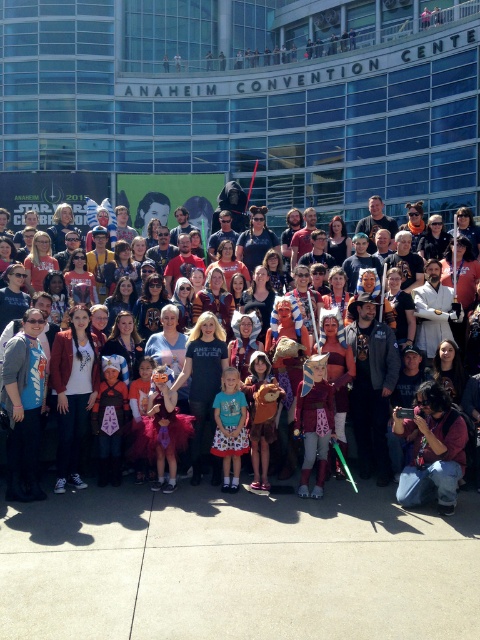
Based on the photo, does matte pink dress at center have a larger size compared to matte blue shirt at center?

Yes.

Between matte pink dress at center and matte blue shirt at center, which one appears on the right side from the viewer's perspective?

Positioned to the right is matte blue shirt at center.

Is point (168, 484) positioned in front of point (227, 449)?

Yes, point (168, 484) is closer to viewer.

I want to click on matte pink dress at center, so click(166, 429).

Measure the distance between multicolored costumes at center and matte blue shirt at center.

A distance of 7.45 feet exists between multicolored costumes at center and matte blue shirt at center.

Is point (373, 493) positioned before point (228, 433)?

Yes, it is in front of point (228, 433).

The width and height of the screenshot is (480, 640). Describe the element at coordinates (98, 504) in the screenshot. I see `multicolored costumes at center` at that location.

This screenshot has width=480, height=640. I want to click on multicolored costumes at center, so click(98, 504).

Looking at this image, is multicolored costumes at center to the right of matte pink dress at center from the viewer's perspective?

Incorrect, multicolored costumes at center is not on the right side of matte pink dress at center.

Who is lower down, multicolored costumes at center or matte pink dress at center?

Positioned lower is multicolored costumes at center.

Is point (379, 492) farther from camera compared to point (168, 413)?

No, it is in front of (168, 413).

This screenshot has height=640, width=480. I want to click on multicolored costumes at center, so click(98, 504).